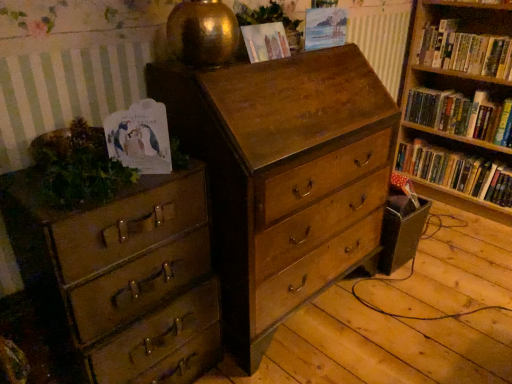
Question: Can we say hardcover book at right, acting as the second book starting from the top, lies outside hardcover book at right, the third book from the top?

Choices:
 (A) no
 (B) yes

Answer: (B)

Question: Is hardcover book at right, acting as the second book starting from the top, turned away from hardcover book at right, the 1th book positioned from the bottom?

Choices:
 (A) no
 (B) yes

Answer: (A)

Question: Is hardcover book at right, acting as the second book starting from the top, shorter than hardcover book at right, the third book from the top?

Choices:
 (A) no
 (B) yes

Answer: (A)

Question: Considering the relative sizes of hardcover book at right, placed as the second book when sorted from bottom to top, and hardcover book at right, the 1th book positioned from the bottom, in the image provided, is hardcover book at right, placed as the second book when sorted from bottom to top, smaller than hardcover book at right, the 1th book positioned from the bottom,?

Choices:
 (A) yes
 (B) no

Answer: (A)

Question: Can you confirm if hardcover book at right, placed as the second book when sorted from bottom to top, is bigger than hardcover book at right, the 1th book positioned from the bottom?

Choices:
 (A) no
 (B) yes

Answer: (A)

Question: Is point (15, 256) closer or farther from the camera than point (458, 155)?

Choices:
 (A) closer
 (B) farther

Answer: (A)

Question: From the image's perspective, is matte brown chest of drawers at left, positioned as the 1th chest of drawers in left-to-right order, positioned above or below hardcover book at right, the third book from the top?

Choices:
 (A) above
 (B) below

Answer: (B)

Question: Is matte brown chest of drawers at left, positioned as the 1th chest of drawers in left-to-right order, bigger or smaller than hardcover book at right, the 1th book positioned from the bottom?

Choices:
 (A) small
 (B) big

Answer: (B)

Question: In the image, is matte brown chest of drawers at left, the second chest of drawers when ordered from right to left, positioned in front of or behind hardcover book at right, the 1th book positioned from the bottom?

Choices:
 (A) behind
 (B) front

Answer: (B)

Question: In terms of size, does green leafy plant at left, placed as the 1th plant when sorted from bottom to top, appear bigger or smaller than matte brown chest of drawers at left, positioned as the 1th chest of drawers in left-to-right order?

Choices:
 (A) big
 (B) small

Answer: (B)

Question: In the image, is green leafy plant at left, placed as the 1th plant when sorted from bottom to top, positioned in front of or behind matte brown chest of drawers at left, positioned as the 1th chest of drawers in left-to-right order?

Choices:
 (A) front
 (B) behind

Answer: (A)

Question: Considering the relative positions of green leafy plant at left, placed as the 1th plant when sorted from bottom to top, and matte brown chest of drawers at left, the second chest of drawers when ordered from right to left, in the image provided, is green leafy plant at left, placed as the 1th plant when sorted from bottom to top, to the left or to the right of matte brown chest of drawers at left, the second chest of drawers when ordered from right to left,?

Choices:
 (A) right
 (B) left

Answer: (B)

Question: Is point 76,134 closer or farther from the camera than point 144,324?

Choices:
 (A) farther
 (B) closer

Answer: (B)

Question: Is hardcover book at right, the third book from the top, wider or thinner than matte brown chest of drawers at left, positioned as the 1th chest of drawers in left-to-right order?

Choices:
 (A) thin
 (B) wide

Answer: (A)

Question: Considering the relative positions of hardcover book at right, the 1th book positioned from the bottom, and matte brown chest of drawers at left, positioned as the 1th chest of drawers in left-to-right order, in the image provided, is hardcover book at right, the 1th book positioned from the bottom, to the left or to the right of matte brown chest of drawers at left, positioned as the 1th chest of drawers in left-to-right order,?

Choices:
 (A) left
 (B) right

Answer: (B)